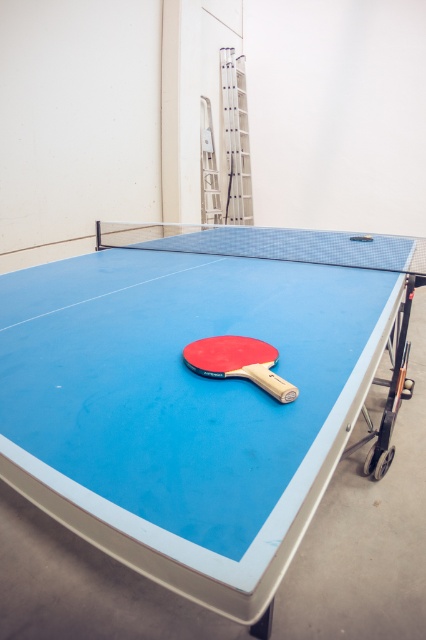
Question: Can you confirm if blue rubber table at center is positioned to the right of red matte table tennis racket at center?

Choices:
 (A) no
 (B) yes

Answer: (A)

Question: Which object is farther from the camera taking this photo?

Choices:
 (A) red matte table tennis racket at center
 (B) blue rubber table at center

Answer: (A)

Question: Does blue rubber table at center appear under red matte table tennis racket at center?

Choices:
 (A) yes
 (B) no

Answer: (A)

Question: Does blue rubber table at center appear under red matte table tennis racket at center?

Choices:
 (A) yes
 (B) no

Answer: (A)

Question: Which point is closer to the camera?

Choices:
 (A) red matte table tennis racket at center
 (B) blue rubber table at center

Answer: (B)